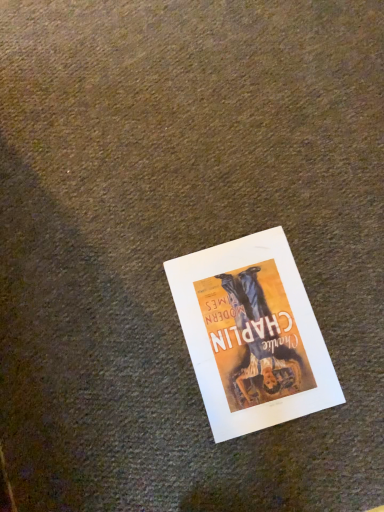
You are a GUI agent. You are given a task and a screenshot of the screen. Output one action in this format:
    pyautogui.click(x=<x>, y=<y>)
    Task: Click on the free space in front of white paper poster at center
    
    Given the screenshot: What is the action you would take?
    pyautogui.click(x=283, y=454)